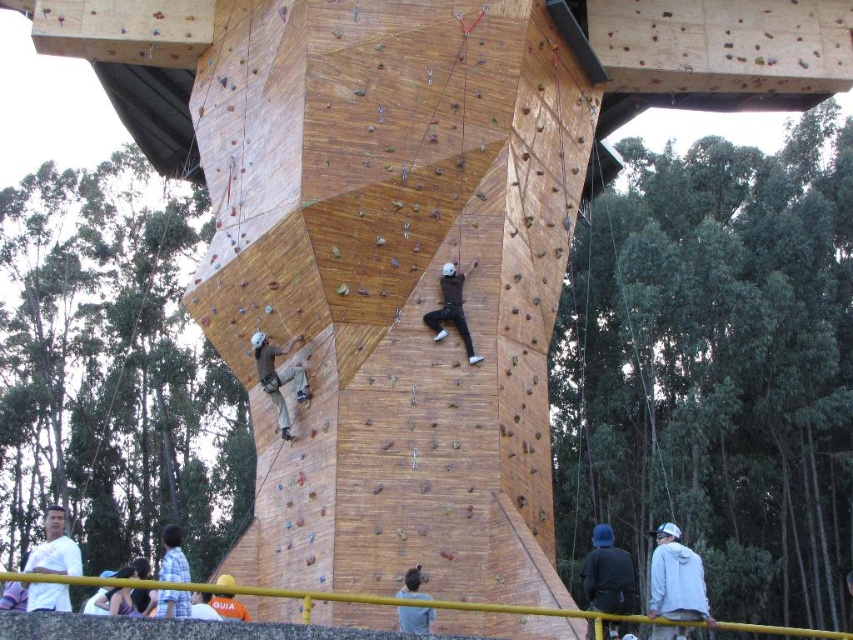
Question: Does white matte jacket at lower right come behind dark blue jacket at center?

Choices:
 (A) no
 (B) yes

Answer: (A)

Question: Which is farther from the dark blue jacket at center?

Choices:
 (A) matte brown pants at center
 (B) black matte climbing suit at center
 (C) white matte jacket at lower right
 (D) dark gray fabric shirt at lower center

Answer: (A)

Question: Is white matte jacket at lower right wider than dark blue jacket at center?

Choices:
 (A) yes
 (B) no

Answer: (A)

Question: Among these objects, which one is nearest to the camera?

Choices:
 (A) matte brown pants at center
 (B) dark gray fabric shirt at lower center
 (C) dark blue jacket at center

Answer: (C)

Question: Can you confirm if white matte jacket at lower right is positioned below white matte shirt at lower left?

Choices:
 (A) no
 (B) yes

Answer: (A)

Question: Among these points, which one is farthest from the camera?

Choices:
 (A) (410, 612)
 (B) (691, 550)
 (C) (271, 355)

Answer: (B)